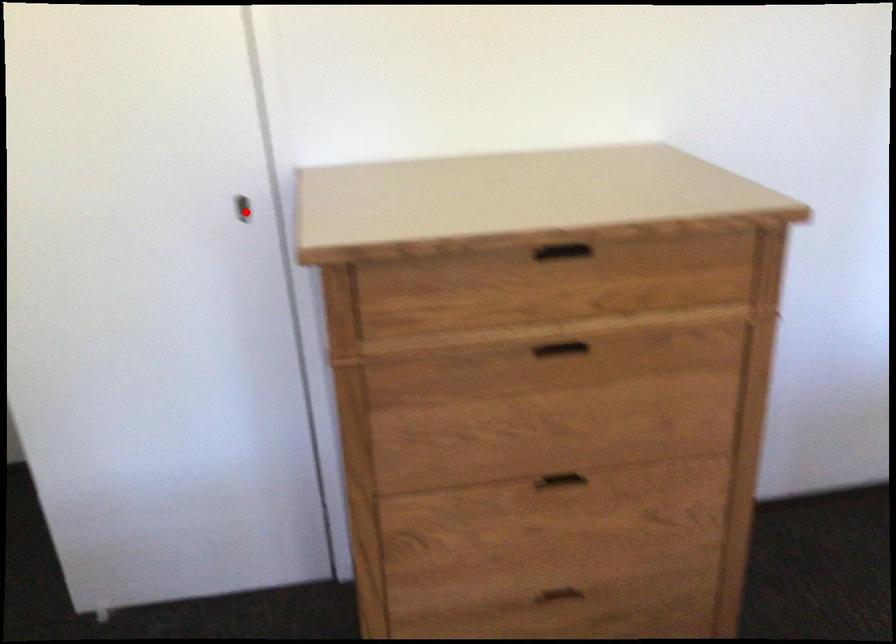
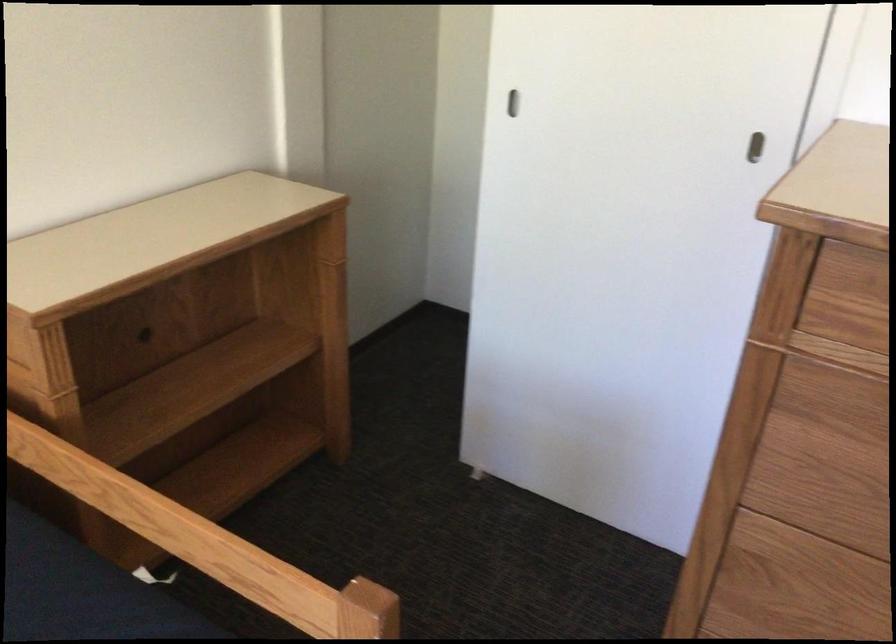
Question: I am providing you with two images of the same scene from different viewpoints. A red point is marked on the first image. Can you still see the location of the red point in image 2?

Choices:
 (A) Yes
 (B) No

Answer: (A)